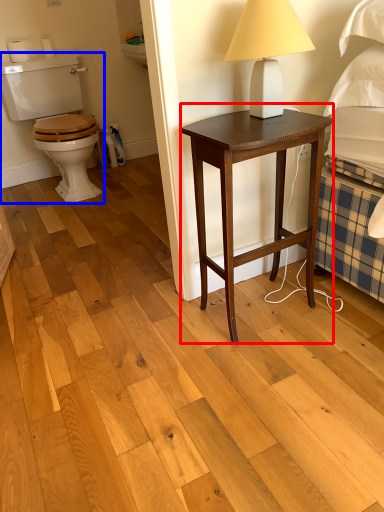
Question: Which point is closer to the camera, nightstand (highlighted by a red box) or sit (highlighted by a blue box)?

Choices:
 (A) nightstand
 (B) sit

Answer: (A)